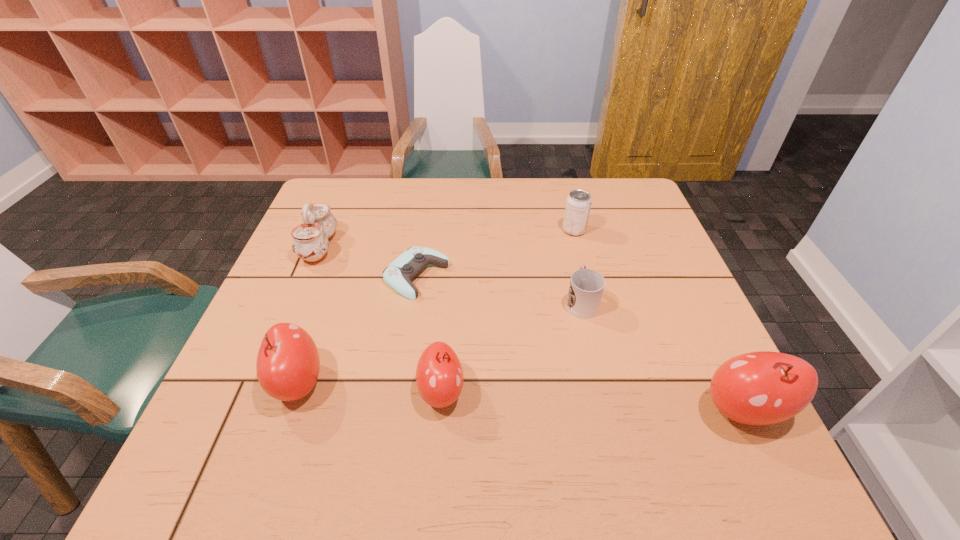
Locate an element on the screen. free location located on the back of the soda can is located at coordinates (565, 197).

Where is `free point located 0.160m on the right of the shortest object`? free point located 0.160m on the right of the shortest object is located at coordinates (511, 276).

Where is `vacant region located by the handle of the chinaware`? vacant region located by the handle of the chinaware is located at coordinates (405, 247).

What are the coordinates of `vacant area situated on the side of the sixth tallest object where the handle is located` in the screenshot? It's located at (557, 198).

At what (x,y) coordinates should I click in order to perform the action: click on vacant space located 0.340m on the side of the sixth tallest object where the handle is located. Please return your answer as a coordinate pair (x, y). Looking at the image, I should click on (560, 209).

The height and width of the screenshot is (540, 960). In order to click on vacant space located 0.210m on the side of the sixth tallest object where the handle is located in this screenshot , I will do `click(565, 235)`.

You are a GUI agent. You are given a task and a screenshot of the screen. Output one action in this format:
    pyautogui.click(x=<x>, y=<y>)
    Task: Click on the apple at the left edge
    The width and height of the screenshot is (960, 540).
    Given the screenshot: What is the action you would take?
    pyautogui.click(x=288, y=363)

Locate an element on the screen. chinaware that is positioned at the left edge is located at coordinates (310, 242).

Identify the location of object situated at the right edge. The height and width of the screenshot is (540, 960). (760, 388).

Find the location of a particular element. The width and height of the screenshot is (960, 540). object that is at the near left corner is located at coordinates (288, 363).